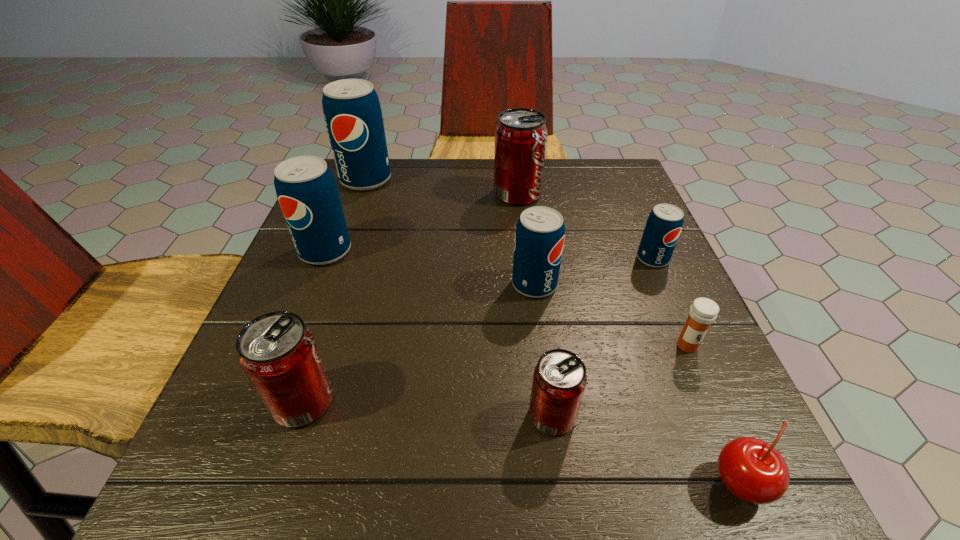
You are a GUI agent. You are given a task and a screenshot of the screen. Output one action in this format:
    pyautogui.click(x=<x>, y=<y>)
    Task: Click on the red pop soda that is the nearest to the second biggest blue pop
    Image resolution: width=960 pixels, height=540 pixels.
    Given the screenshot: What is the action you would take?
    pyautogui.click(x=277, y=351)

This screenshot has height=540, width=960. I want to click on the closest red pop soda to the sixth farthest object, so click(559, 380).

You are a GUI agent. You are given a task and a screenshot of the screen. Output one action in this format:
    pyautogui.click(x=<x>, y=<y>)
    Task: Click on the vacant point that satisfies the following two spatial constraints: 1. on the front side of the smallest red pop soda; 2. on the right side of the second biggest blue pop
    The height and width of the screenshot is (540, 960).
    Given the screenshot: What is the action you would take?
    pyautogui.click(x=260, y=415)

Identify the location of vacant area in the image that satisfies the following two spatial constraints: 1. on the back side of the third nearest pop soda; 2. on the left side of the leftmost red pop soda. (342, 285).